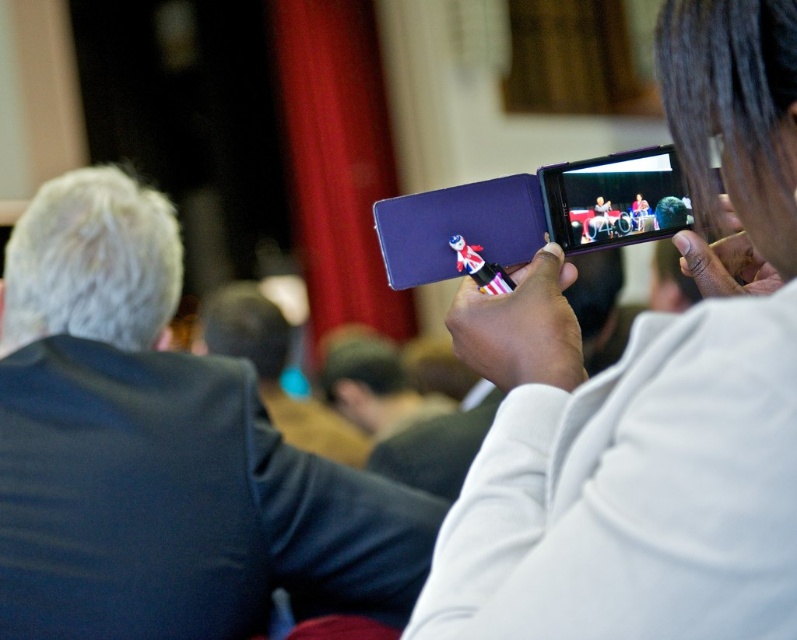
Is dark blue suit at left shorter than matte purple phone at upper right?

No, dark blue suit at left is not shorter than matte purple phone at upper right.

Between point (159, 291) and point (559, 211), which one is positioned behind?

The point (159, 291) is more distant.

Find the location of a particular element. The height and width of the screenshot is (640, 797). dark blue suit at left is located at coordinates point(159,451).

Which is more to the left, matte purple phone at upper right or dark brown leather jacket at center?

Positioned to the left is dark brown leather jacket at center.

Measure the distance between matte purple phone at upper right and camera.

A distance of 30.29 inches exists between matte purple phone at upper right and camera.

What are the coordinates of `matte purple phone at upper right` in the screenshot? It's located at (614, 198).

Is dark blue suit at left behind dark brown leather jacket at center?

No, it is in front of dark brown leather jacket at center.

Does dark blue suit at left appear over dark brown leather jacket at center?

Yes.

Based on the photo, who is more distant from viewer, (152, 195) or (289, 333)?

Point (289, 333)

At what (x,y) coordinates should I click in order to perform the action: click on dark blue suit at left. Please return your answer as a coordinate pair (x, y). Image resolution: width=797 pixels, height=640 pixels. Looking at the image, I should click on (159, 451).